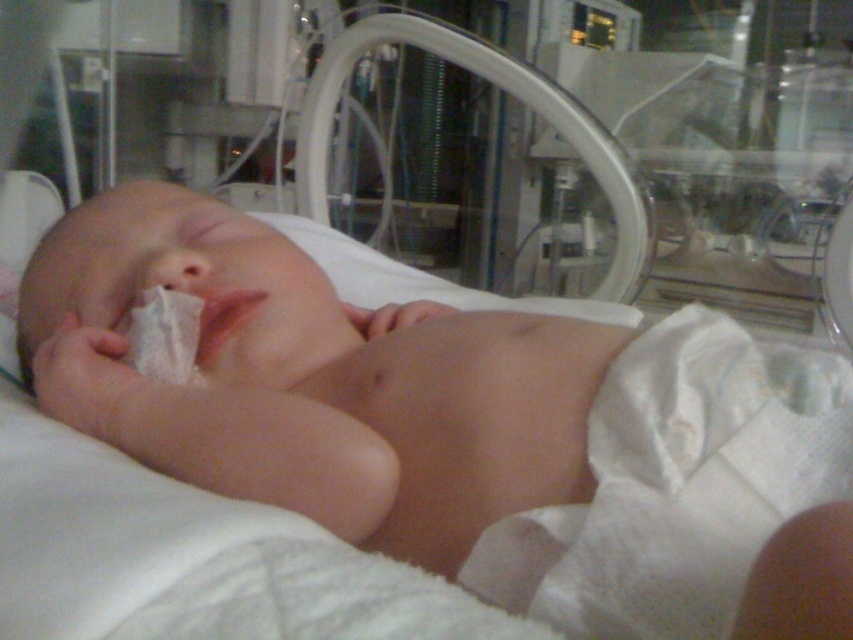
Question: Does white cloth diaper at center come behind smooth flesh nose at center?

Choices:
 (A) yes
 (B) no

Answer: (B)

Question: Which object is the farthest from the white cloth diaper at center?

Choices:
 (A) smooth skin newborn at center
 (B) smooth flesh nose at center

Answer: (B)

Question: Among these objects, which one is farthest from the camera?

Choices:
 (A) smooth skin newborn at center
 (B) smooth flesh nose at center
 (C) white cloth diaper at center

Answer: (B)

Question: Which point is farther to the camera?

Choices:
 (A) (177, 260)
 (B) (657, 397)

Answer: (A)

Question: Can you confirm if smooth skin newborn at center is smaller than white cloth diaper at center?

Choices:
 (A) yes
 (B) no

Answer: (B)

Question: Does smooth skin newborn at center appear under smooth flesh nose at center?

Choices:
 (A) no
 (B) yes

Answer: (B)